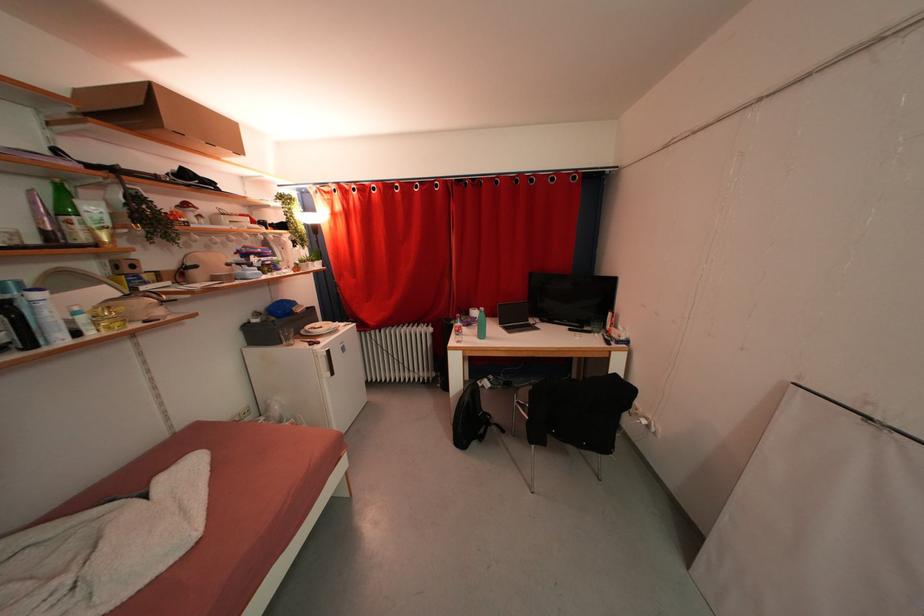
Find where to lift the beige cosmetic bag. Please return your answer as a coordinate pair (x, y).

(136, 306)